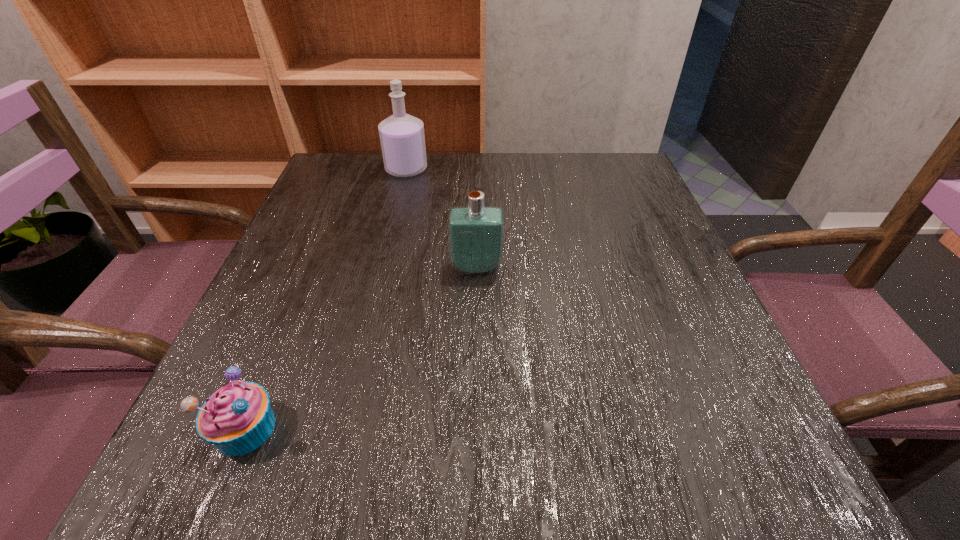
Locate an element on the screen. The height and width of the screenshot is (540, 960). the second object from right to left is located at coordinates (402, 138).

Image resolution: width=960 pixels, height=540 pixels. I want to click on the taller perfume, so click(402, 138).

Where is `the second shortest object`? Image resolution: width=960 pixels, height=540 pixels. the second shortest object is located at coordinates (476, 232).

This screenshot has height=540, width=960. Identify the location of the nearer perfume. (476, 232).

Find the location of `the shortest object`. the shortest object is located at coordinates [x=237, y=419].

Find the location of a particular element. This screenshot has height=540, width=960. muffin is located at coordinates (237, 419).

Where is `free space located 0.100m on the left of the second object from right to left`? free space located 0.100m on the left of the second object from right to left is located at coordinates click(346, 170).

The height and width of the screenshot is (540, 960). What are the coordinates of `vacant space located on the front label of the second tallest object` in the screenshot? It's located at (475, 442).

The width and height of the screenshot is (960, 540). Identify the location of free location located 0.260m on the back of the leftmost object. [309, 276].

Image resolution: width=960 pixels, height=540 pixels. Find the location of `object present at the far edge`. object present at the far edge is located at coordinates (402, 138).